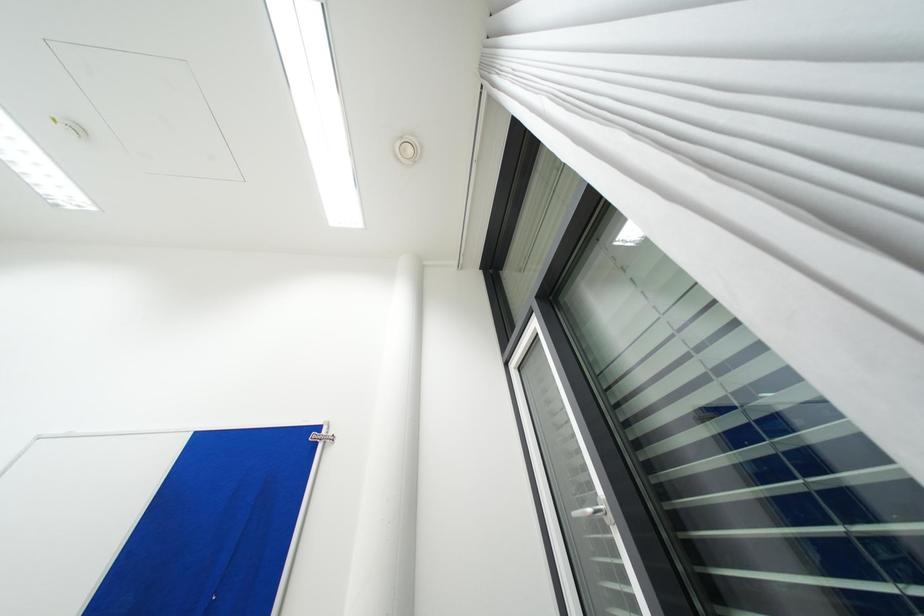
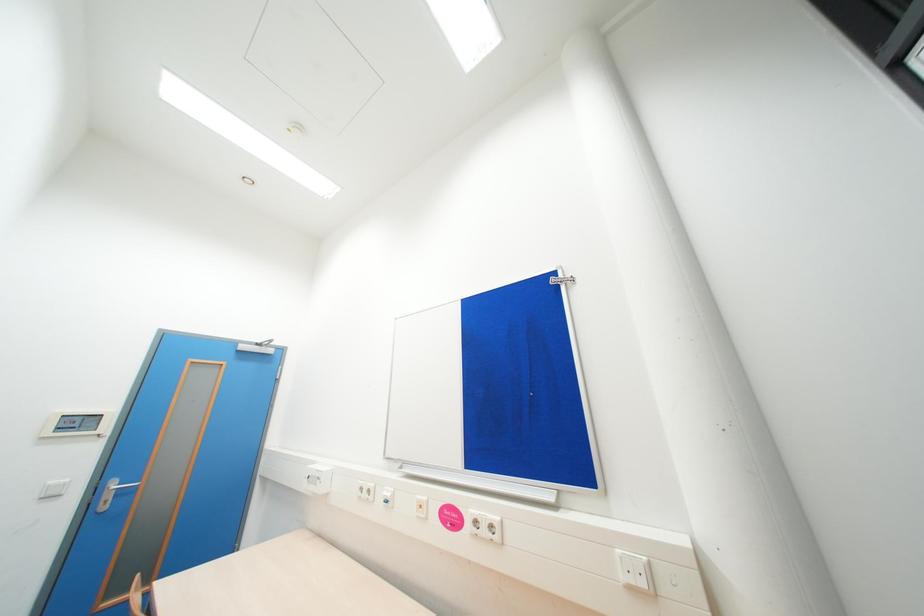
Question: Based on the continuous images, in which direction is the camera rotating? Reply with the corresponding letter.

Choices:
 (A) Left
 (B) Right
 (C) Up
 (D) Down

Answer: (A)